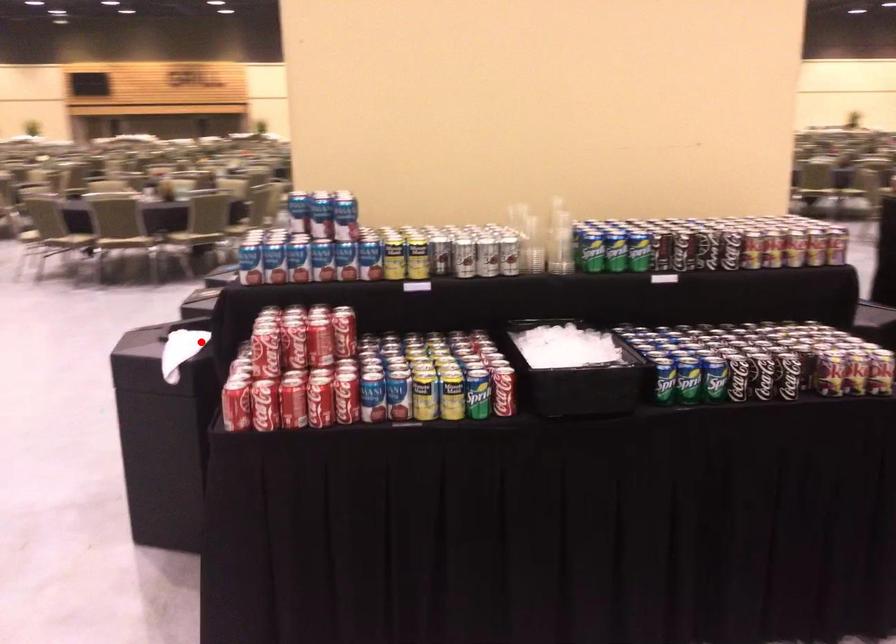
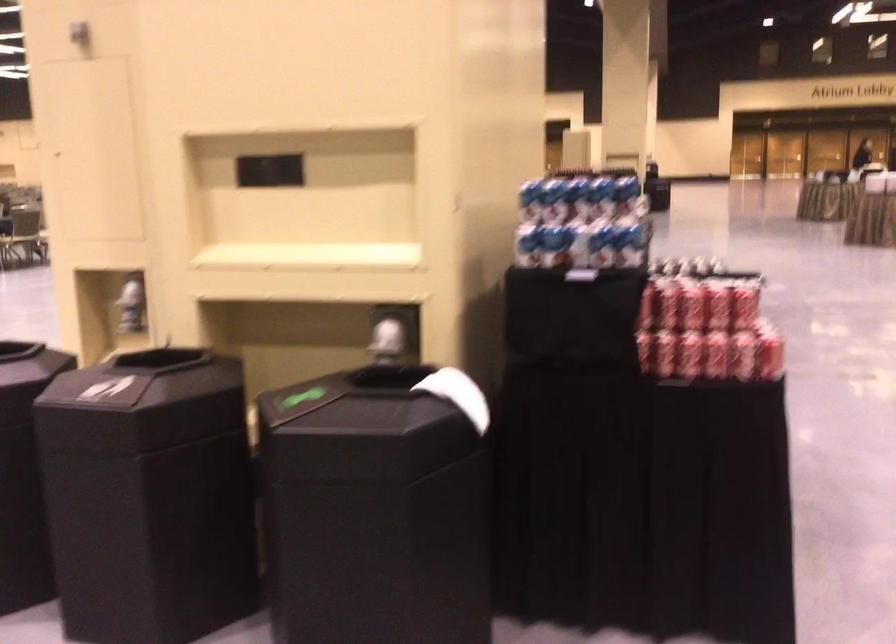
Question: I am providing you with two images of the same scene from different viewpoints. A red point is shown in image1. For the corresponding object point in image2, is it positioned nearer or farther from the camera?

Choices:
 (A) Nearer
 (B) Farther

Answer: (A)